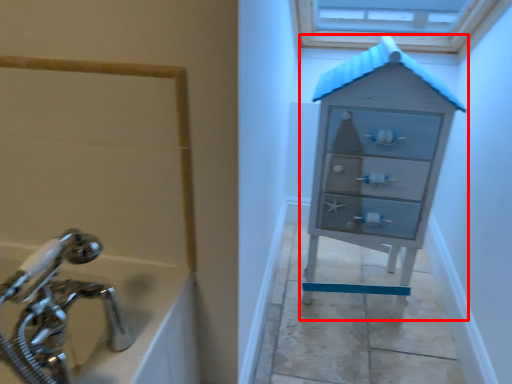
Question: From the image's perspective, where is chest of drawers (annotated by the red box) located in relation to tap in the image?

Choices:
 (A) above
 (B) below

Answer: (A)